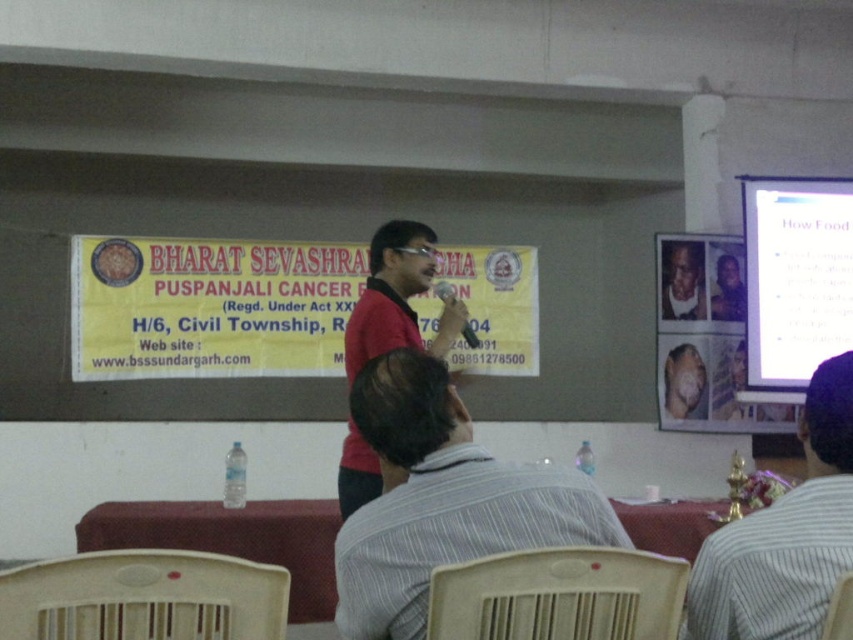
Is white glossy projection screen at upper right shorter than purple glossy photo frame at upper center?

Incorrect, white glossy projection screen at upper right's height does not fall short of purple glossy photo frame at upper center's.

Can you confirm if white glossy projection screen at upper right is positioned to the right of purple glossy photo frame at upper center?

Yes, white glossy projection screen at upper right is to the right of purple glossy photo frame at upper center.

Which is in front, point (764, 209) or point (721, 314)?

Point (764, 209) is more forward.

Where is `white glossy projection screen at upper right`? white glossy projection screen at upper right is located at coordinates (793, 280).

Can you confirm if white glossy projection screen at upper right is bigger than wooden chair at lower right?

Yes, white glossy projection screen at upper right is bigger than wooden chair at lower right.

Which is more to the right, white glossy projection screen at upper right or wooden chair at lower right?

white glossy projection screen at upper right

You are a GUI agent. You are given a task and a screenshot of the screen. Output one action in this format:
    pyautogui.click(x=<x>, y=<y>)
    Task: Click on the white glossy projection screen at upper right
    This screenshot has width=853, height=640.
    Given the screenshot: What is the action you would take?
    pyautogui.click(x=793, y=280)

Where is `white glossy projection screen at upper right`? This screenshot has width=853, height=640. white glossy projection screen at upper right is located at coordinates (793, 280).

Is point (447, 312) more distant than point (691, 417)?

No.

Which is more to the right, red matte shirt at center or smooth beige skin at center?

smooth beige skin at center

Describe the element at coordinates (389, 292) in the screenshot. I see `red matte shirt at center` at that location.

Where is `red matte shirt at center`? red matte shirt at center is located at coordinates (389, 292).